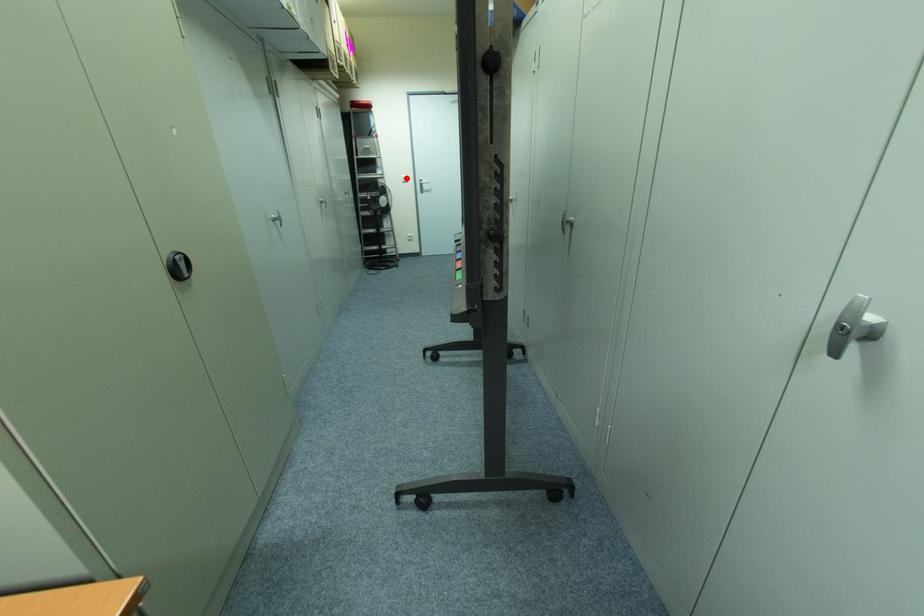
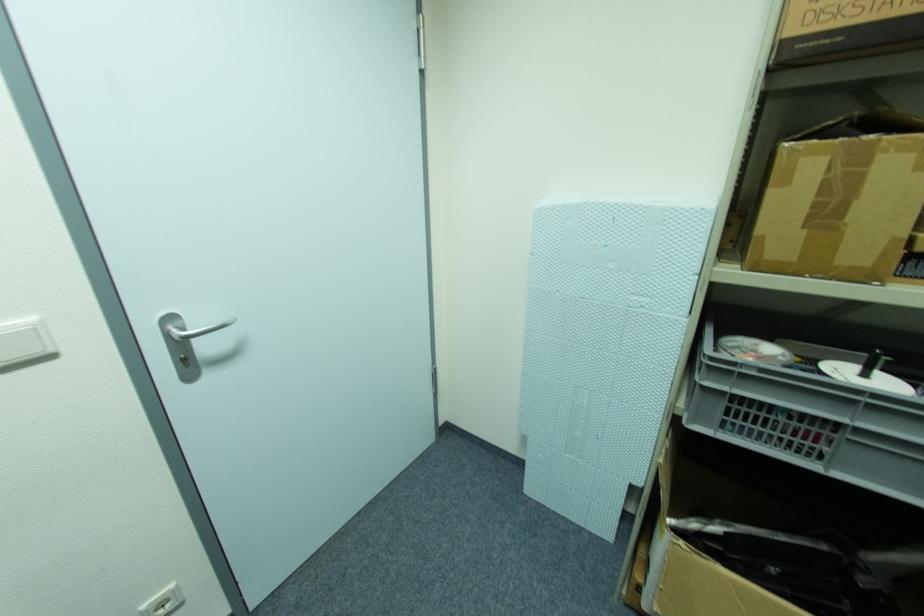
Question: A red point is marked in image1. In image2, is the corresponding 3D point closer to the camera or farther? Reply with the corresponding letter.

Choices:
 (A) The corresponding 3D point is closer.
 (B) The corresponding 3D point is farther.

Answer: (B)